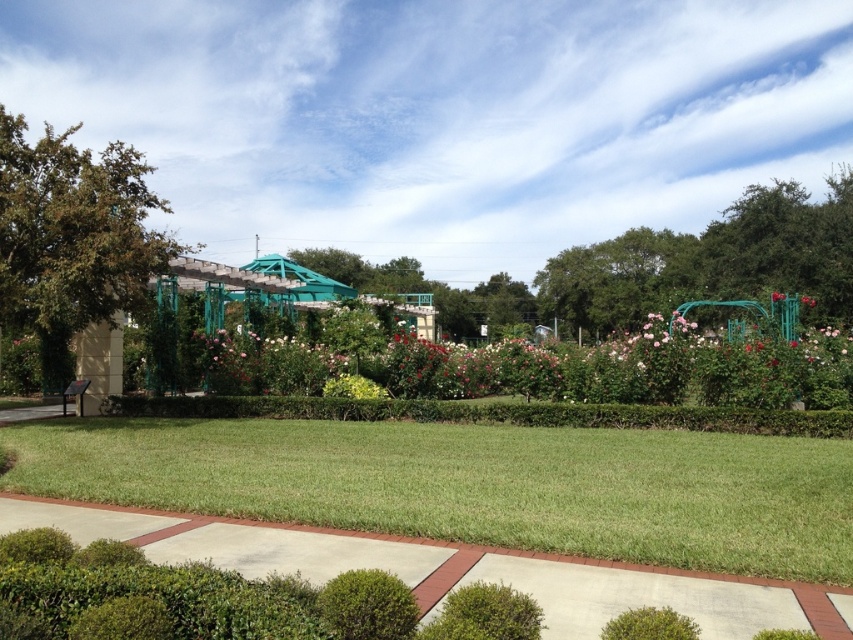
You are standing in the garden and want to walk from the starting point to the destination point. The starting point is at point (532, 488) and the destination is at point (697, 250). Based on the garden layout described, will you have to walk over any obstacles between these two points?

Since point (532, 488) is in front of point (697, 250), you will not encounter any obstacles between them as they are positioned in a straight path without any mentioned barriers in the scene description.

You are planning to install a new sprinkler system in the garden. The sprinkler has a maximum range of 50 meters. Given the distance between the green leafy tree at left and the green leafy tree at center, can one sprinkler cover both trees?

The green leafy tree at left and green leafy tree at center are 58.06 meters apart. Since the sprinkler has a maximum range of 50 meters, it cannot cover both trees simultaneously.

You are a gardener planning to plant a new flower bed between the concrete at center and the green leafy bush at lower center. Based on their positions, which object should you start digging near to place the flowers in between them?

You should start digging near the concrete at center because it is to the left of the green leafy bush at lower center, so placing the flowers between them would require starting closer to the concrete at center.